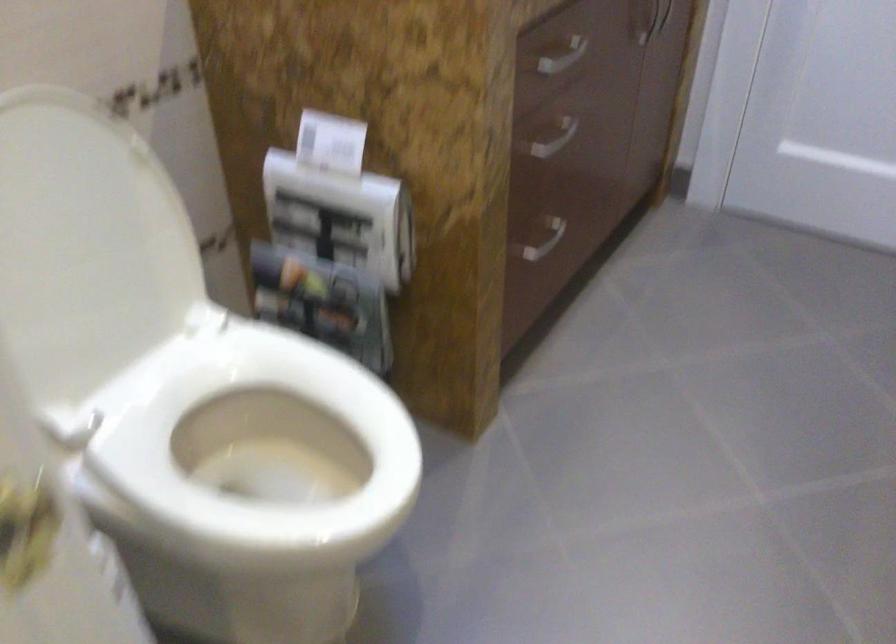
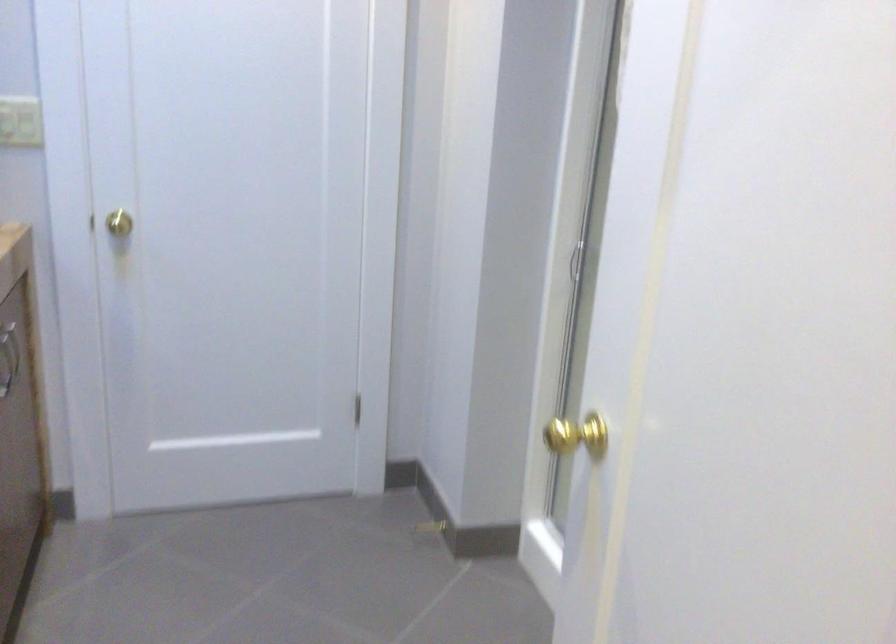
Question: Based on the continuous images, in which direction is the camera rotating? Reply with the corresponding letter.

Choices:
 (A) Left
 (B) Right
 (C) Up
 (D) Down

Answer: (B)